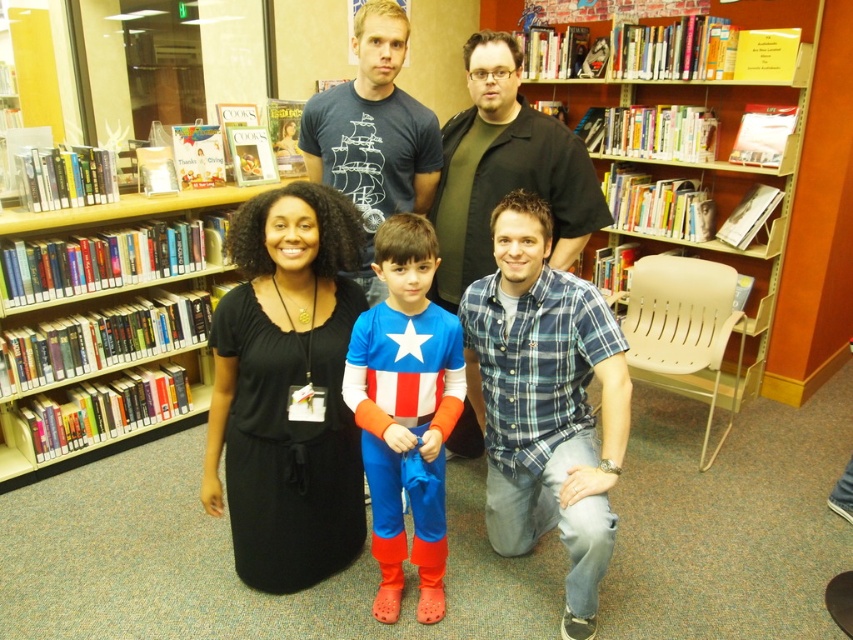
You are an observer standing in front of the bookshelves. You notice the black matte dress at center and the blue plaid shirt at lower center. Which one is covering part of the other?

The black matte dress at center is positioned over the blue plaid shirt at lower center, so it is covering part of it.

You are a librarian organizing a display. You have a black matte dress at center and hardcover books at left. Which item should you place to the left side of the other?

The black matte dress at center is positioned on the right side of hardcover books at left, so you should place the hardcover books at left to the left side of the black matte dress at center.